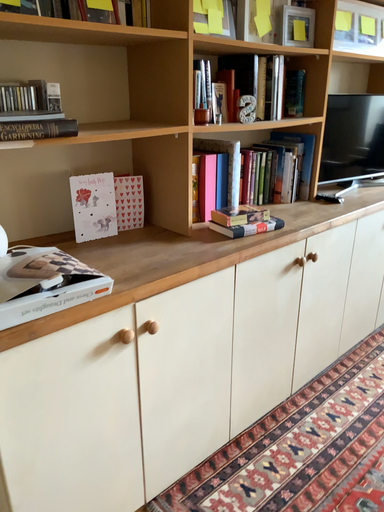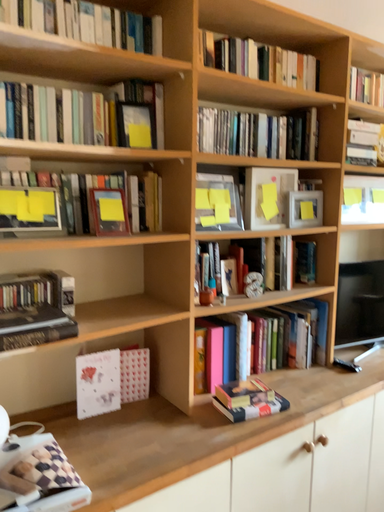
Question: Which way did the camera rotate in the video?

Choices:
 (A) rotated right
 (B) rotated left

Answer: (B)